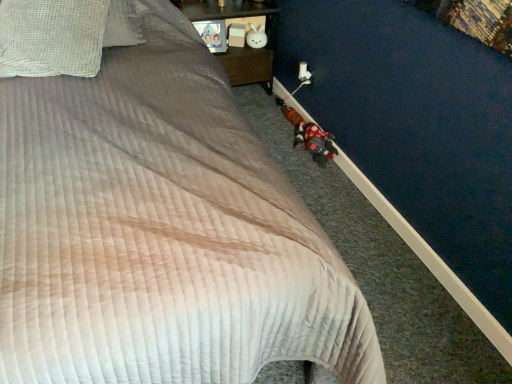
Question: Is white matte plush rabbit at upper center, which is counted as the second toy, starting from the right, behind wooden nightstand at upper center?

Choices:
 (A) yes
 (B) no

Answer: (A)

Question: Would you say white matte plush rabbit at upper center, acting as the 1th toy starting from the top, contains wooden nightstand at upper center?

Choices:
 (A) yes
 (B) no

Answer: (B)

Question: Can you confirm if white matte plush rabbit at upper center, acting as the 1th toy starting from the top, is positioned to the right of wooden nightstand at upper center?

Choices:
 (A) yes
 (B) no

Answer: (A)

Question: Is white matte plush rabbit at upper center, which ranks as the 1th toy in back-to-front order, wider than wooden nightstand at upper center?

Choices:
 (A) yes
 (B) no

Answer: (B)

Question: Does white matte plush rabbit at upper center, which appears as the 2th toy when viewed from the front, lie in front of wooden nightstand at upper center?

Choices:
 (A) no
 (B) yes

Answer: (A)

Question: From a real-world perspective, is white matte plush rabbit at upper center, acting as the 1th toy starting from the top, physically below wooden nightstand at upper center?

Choices:
 (A) yes
 (B) no

Answer: (B)

Question: Considering the relative positions of white matte plush rabbit at upper center, which ranks as the 1th toy in back-to-front order, and white checkered pillow at upper left in the image provided, is white matte plush rabbit at upper center, which ranks as the 1th toy in back-to-front order, to the right of white checkered pillow at upper left from the viewer's perspective?

Choices:
 (A) no
 (B) yes

Answer: (B)

Question: Is white matte plush rabbit at upper center, acting as the 1th toy starting from the top, wider than white checkered pillow at upper left?

Choices:
 (A) yes
 (B) no

Answer: (B)

Question: Is white matte plush rabbit at upper center, which is counted as the second toy, starting from the right, positioned beyond the bounds of white checkered pillow at upper left?

Choices:
 (A) yes
 (B) no

Answer: (A)

Question: Is white matte plush rabbit at upper center, which is counted as the first toy, starting from the left, oriented away from white checkered pillow at upper left?

Choices:
 (A) no
 (B) yes

Answer: (A)

Question: From the image's perspective, is white matte plush rabbit at upper center, which is counted as the first toy, starting from the left, located above white checkered pillow at upper left?

Choices:
 (A) no
 (B) yes

Answer: (B)

Question: From a real-world perspective, is white matte plush rabbit at upper center, placed as the 2th toy when sorted from bottom to top, below white checkered pillow at upper left?

Choices:
 (A) yes
 (B) no

Answer: (A)

Question: Considering the relative positions of white matte plush rabbit at upper center, placed as the 2th toy when sorted from bottom to top, and fluffy plush toy at lower right, the first toy viewed from the right, in the image provided, is white matte plush rabbit at upper center, placed as the 2th toy when sorted from bottom to top, in front of fluffy plush toy at lower right, the first toy viewed from the right,?

Choices:
 (A) no
 (B) yes

Answer: (A)